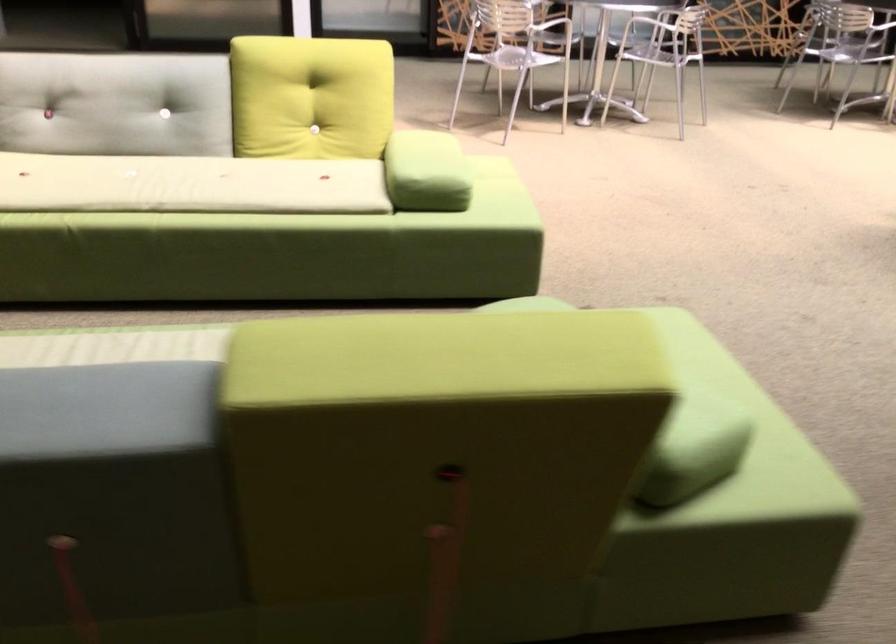
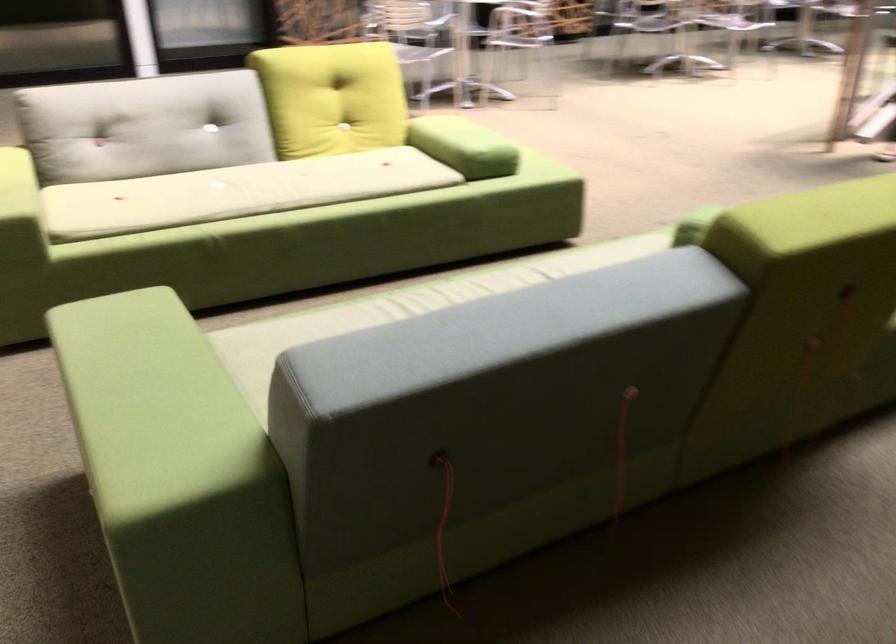
Find the pixel in the second image that matches pixel 394 169 in the first image.

(464, 146)